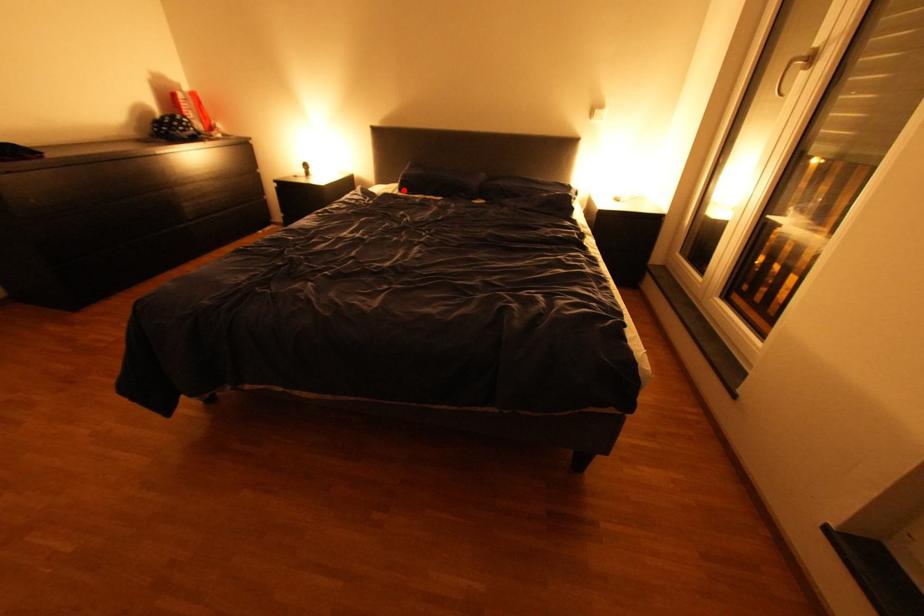
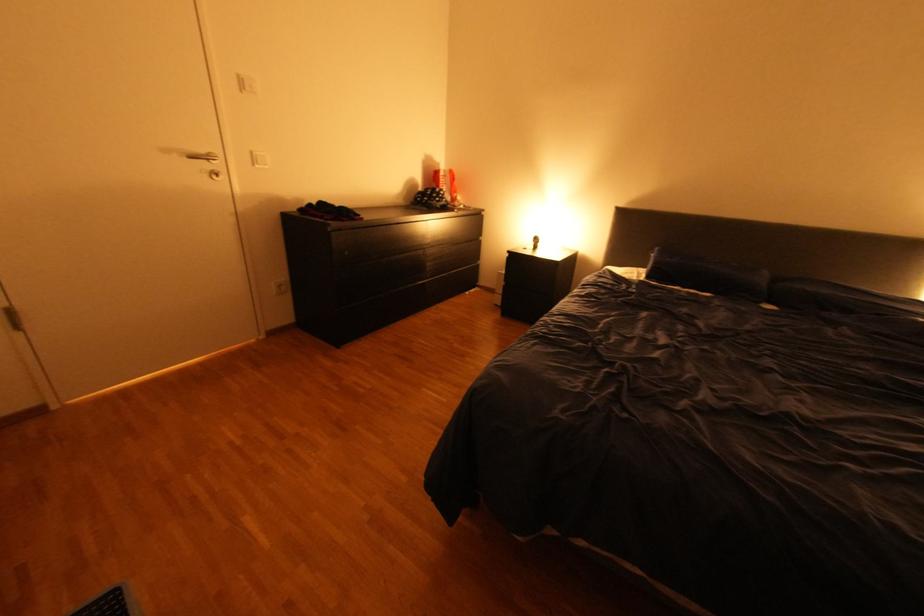
The point at the highlighted location is marked in the first image. Where is the corresponding point in the second image?

(648, 277)